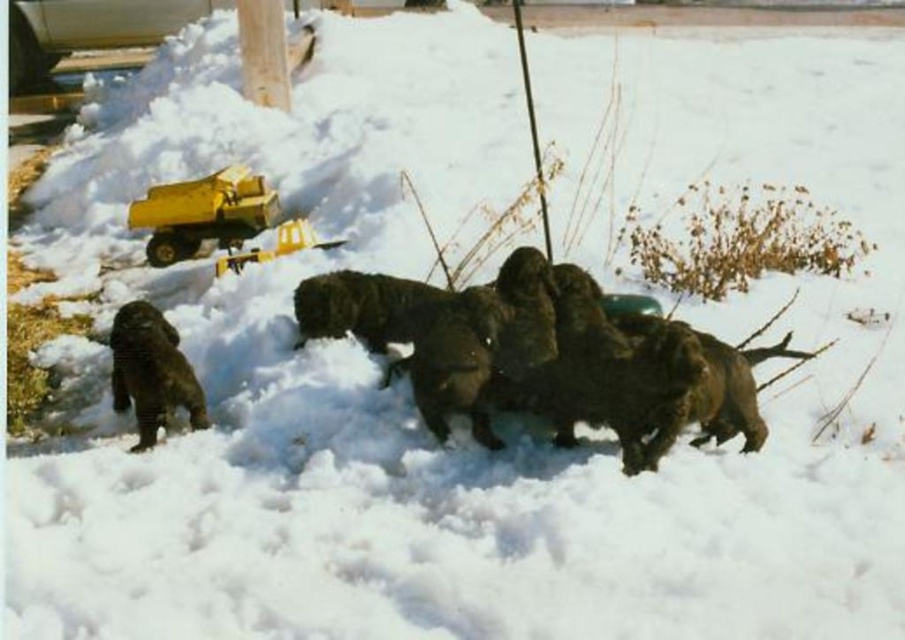
Between fuzzy brown dog at left and smooth wood pole at upper center, which one is positioned higher?

Positioned higher is smooth wood pole at upper center.

The image size is (905, 640). Describe the element at coordinates (151, 371) in the screenshot. I see `fuzzy brown dog at left` at that location.

Is point (159, 332) positioned after point (525, 76)?

That is False.

At what (x,y) coordinates should I click in order to perform the action: click on fuzzy brown dog at left. Please return your answer as a coordinate pair (x, y). Looking at the image, I should click on (151, 371).

Measure the distance between point (606, 316) and camera.

Point (606, 316) is 14.83 feet from camera.

Which is in front, point (650, 403) or point (149, 433)?

Positioned in front is point (650, 403).

At what (x,y) coordinates should I click in order to perform the action: click on fuzzy brown dog at center. Please return your answer as a coordinate pair (x, y). Looking at the image, I should click on (584, 364).

Does fuzzy brown dog at center have a lesser height compared to smooth wooden pole at upper center?

Incorrect, fuzzy brown dog at center's height does not fall short of smooth wooden pole at upper center's.

Is fuzzy brown dog at center smaller than smooth wooden pole at upper center?

No, fuzzy brown dog at center is not smaller than smooth wooden pole at upper center.

Where is `fuzzy brown dog at center`? The height and width of the screenshot is (640, 905). fuzzy brown dog at center is located at coordinates (584, 364).